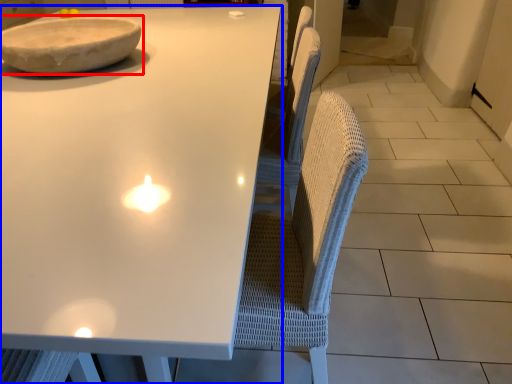
Question: Which object is further to the camera taking this photo, bowl (highlighted by a red box) or table (highlighted by a blue box)?

Choices:
 (A) bowl
 (B) table

Answer: (A)